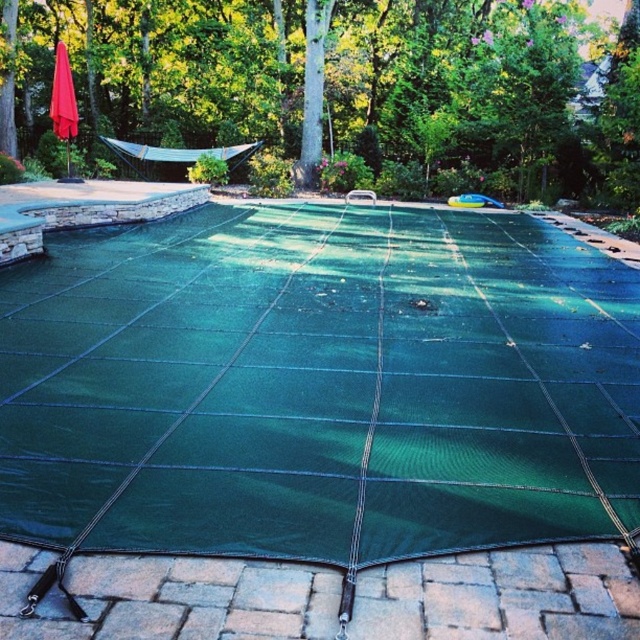
You are standing in the backyard looking at the pool. There is a green mesh netting at center. Where is the green mesh netting located relative to the point at coordinates (342,88)?

The green mesh netting at center is located exactly at the point with coordinates (342,88).

You are designing a backyard layout and need to place both the green mesh net at center and the green mesh netting at center. Given their sizes, which one should you place in a larger area to fit properly?

The green mesh netting at center requires a larger area since it occupies more space than the green mesh net at center.